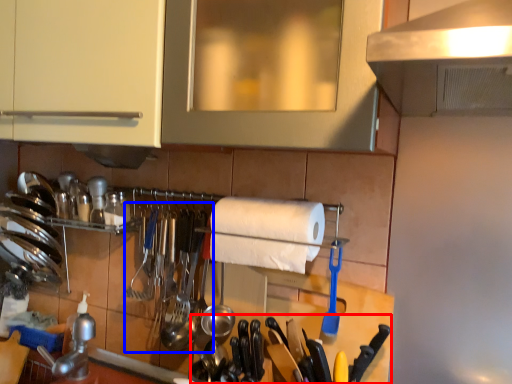
Question: Which of the following is the closest to the observer, cutlery (highlighted by a red box) or silverware (highlighted by a blue box)?

Choices:
 (A) cutlery
 (B) silverware

Answer: (A)